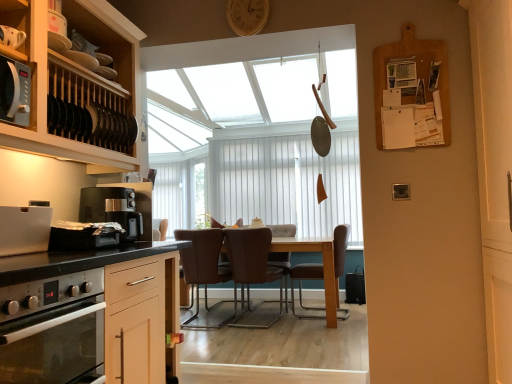
Question: From a real-world perspective, is brown leather chair at center, placed as the second chair when sorted from left to right, located beneath brown leather swivel chair at center?

Choices:
 (A) yes
 (B) no

Answer: (A)

Question: From a real-world perspective, is brown leather chair at center, placed as the second chair when sorted from left to right, on top of brown leather swivel chair at center?

Choices:
 (A) yes
 (B) no

Answer: (B)

Question: Considering the relative positions of brown leather chair at center, placed as the second chair when sorted from left to right, and brown leather swivel chair at center in the image provided, is brown leather chair at center, placed as the second chair when sorted from left to right, behind brown leather swivel chair at center?

Choices:
 (A) yes
 (B) no

Answer: (B)

Question: Is brown leather chair at center, placed as the second chair when sorted from left to right, at the left side of brown leather swivel chair at center?

Choices:
 (A) no
 (B) yes

Answer: (B)

Question: Is brown leather chair at center, the second chair in the right-to-left sequence, wider than brown leather swivel chair at center?

Choices:
 (A) no
 (B) yes

Answer: (B)

Question: Does point (101, 223) appear closer or farther from the camera than point (318, 268)?

Choices:
 (A) farther
 (B) closer

Answer: (B)

Question: In terms of size, does shiny metallic toaster at left appear bigger or smaller than brown leather chair at center, placed as the third chair when sorted from left to right?

Choices:
 (A) big
 (B) small

Answer: (B)

Question: Would you say shiny metallic toaster at left is to the left or to the right of brown leather chair at center, placed as the third chair when sorted from left to right, in the picture?

Choices:
 (A) left
 (B) right

Answer: (A)

Question: From a real-world perspective, is shiny metallic toaster at left positioned above or below brown leather chair at center, placed as the third chair when sorted from left to right?

Choices:
 (A) below
 (B) above

Answer: (B)

Question: Would you say black plastic coffee maker at left is to the left or to the right of matte black plate rack at left in the picture?

Choices:
 (A) right
 (B) left

Answer: (A)

Question: From the image's perspective, is black plastic coffee maker at left positioned above or below matte black plate rack at left?

Choices:
 (A) above
 (B) below

Answer: (B)

Question: Is point (104, 215) positioned closer to the camera than point (37, 134)?

Choices:
 (A) farther
 (B) closer

Answer: (A)

Question: From a real-world perspective, relative to matte black plate rack at left, is black plastic coffee maker at left vertically above or below?

Choices:
 (A) below
 (B) above

Answer: (A)

Question: Is point (253, 31) closer or farther from the camera than point (441, 137)?

Choices:
 (A) closer
 (B) farther

Answer: (B)

Question: From a real-world perspective, is wooden clock at upper center positioned above or below burlap bulletin board at upper right?

Choices:
 (A) below
 (B) above

Answer: (B)